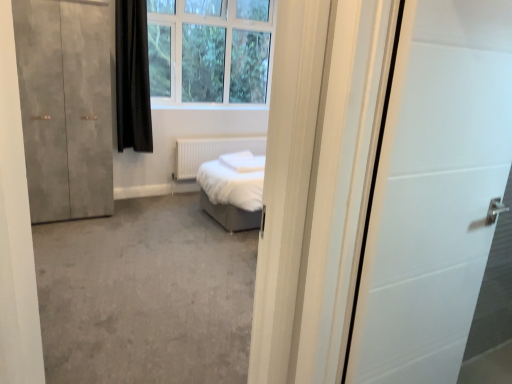
Question: From a real-world perspective, is matte concrete wardrobe at left positioned over black matte curtain at upper left based on gravity?

Choices:
 (A) yes
 (B) no

Answer: (B)

Question: Is matte concrete wardrobe at left to the right of black matte curtain at upper left from the viewer's perspective?

Choices:
 (A) no
 (B) yes

Answer: (A)

Question: Does matte concrete wardrobe at left have a larger size compared to black matte curtain at upper left?

Choices:
 (A) yes
 (B) no

Answer: (A)

Question: Can you confirm if matte concrete wardrobe at left is taller than black matte curtain at upper left?

Choices:
 (A) yes
 (B) no

Answer: (A)

Question: From the image's perspective, does matte concrete wardrobe at left appear lower than black matte curtain at upper left?

Choices:
 (A) no
 (B) yes

Answer: (B)

Question: Does matte concrete wardrobe at left have a smaller size compared to black matte curtain at upper left?

Choices:
 (A) no
 (B) yes

Answer: (A)

Question: Does white matte radiator at center have a larger size compared to white plastic window at upper center?

Choices:
 (A) yes
 (B) no

Answer: (B)

Question: From a real-world perspective, does white matte radiator at center stand above white plastic window at upper center?

Choices:
 (A) yes
 (B) no

Answer: (B)

Question: Is white matte radiator at center in front of white plastic window at upper center?

Choices:
 (A) yes
 (B) no

Answer: (B)

Question: Does white matte radiator at center have a smaller size compared to white plastic window at upper center?

Choices:
 (A) no
 (B) yes

Answer: (B)

Question: Would you say white matte radiator at center is a long distance from white plastic window at upper center?

Choices:
 (A) no
 (B) yes

Answer: (A)

Question: Does white matte radiator at center have a lesser width compared to white plastic window at upper center?

Choices:
 (A) no
 (B) yes

Answer: (B)

Question: Considering the relative sizes of white matte radiator at center and matte concrete wardrobe at left in the image provided, is white matte radiator at center thinner than matte concrete wardrobe at left?

Choices:
 (A) no
 (B) yes

Answer: (B)